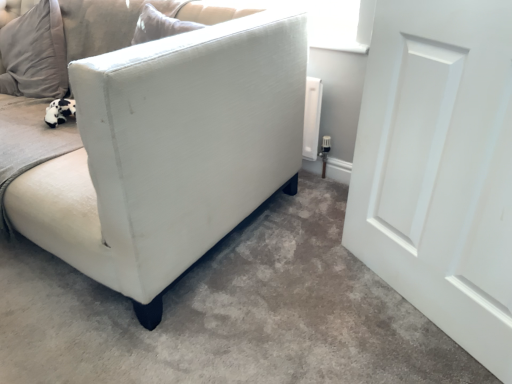
Question: Is white fabric couch at left inside white fabric sofa at lower left?

Choices:
 (A) yes
 (B) no

Answer: (B)

Question: Considering the relative sizes of white fabric sofa at lower left and white fabric couch at left in the image provided, is white fabric sofa at lower left taller than white fabric couch at left?

Choices:
 (A) yes
 (B) no

Answer: (B)

Question: Does white fabric sofa at lower left have a lesser width compared to white fabric couch at left?

Choices:
 (A) yes
 (B) no

Answer: (B)

Question: From a real-world perspective, does white fabric sofa at lower left stand above white fabric couch at left?

Choices:
 (A) no
 (B) yes

Answer: (A)

Question: Is white fabric sofa at lower left closer to the viewer compared to white fabric couch at left?

Choices:
 (A) no
 (B) yes

Answer: (B)

Question: Does white fabric sofa at lower left turn towards white fabric couch at left?

Choices:
 (A) no
 (B) yes

Answer: (A)

Question: Can you confirm if white matte door at right is taller than white fabric sofa at lower left?

Choices:
 (A) yes
 (B) no

Answer: (A)

Question: Is white matte door at right facing away from white fabric sofa at lower left?

Choices:
 (A) yes
 (B) no

Answer: (B)

Question: Considering the relative positions of white matte door at right and white fabric sofa at lower left in the image provided, is white matte door at right in front of white fabric sofa at lower left?

Choices:
 (A) no
 (B) yes

Answer: (A)

Question: From the image's perspective, is white matte door at right beneath white fabric sofa at lower left?

Choices:
 (A) yes
 (B) no

Answer: (B)

Question: Does white matte door at right have a smaller size compared to white fabric sofa at lower left?

Choices:
 (A) no
 (B) yes

Answer: (B)

Question: Is white matte door at right bigger than white fabric sofa at lower left?

Choices:
 (A) yes
 (B) no

Answer: (B)

Question: Is white fabric sofa at lower left at the back of white fabric couch at left?

Choices:
 (A) no
 (B) yes

Answer: (A)